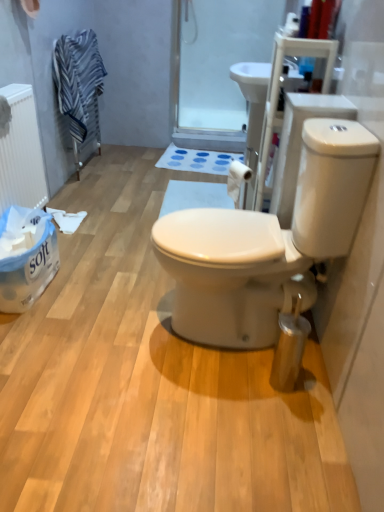
Locate an element on the screen. vacant area to the left of white glossy toilet at center is located at coordinates (104, 326).